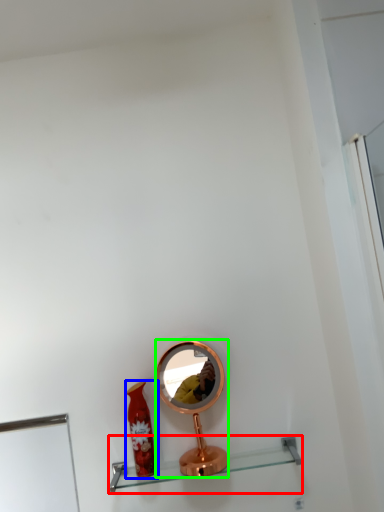
Question: Which object is the farthest from shelf (highlighted by a red box)? Choose among these: bottle (highlighted by a blue box) or mirror (highlighted by a green box).

Choices:
 (A) bottle
 (B) mirror

Answer: (B)